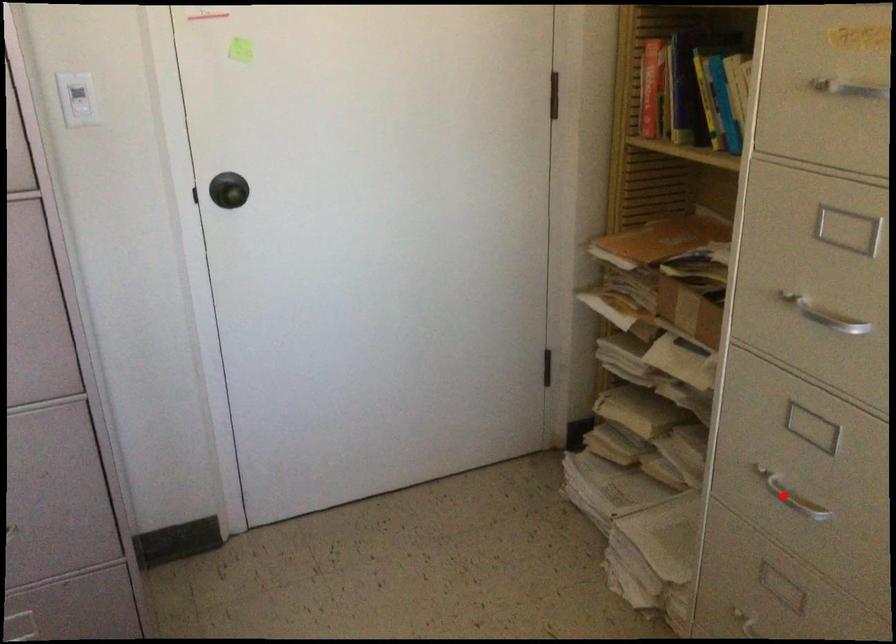
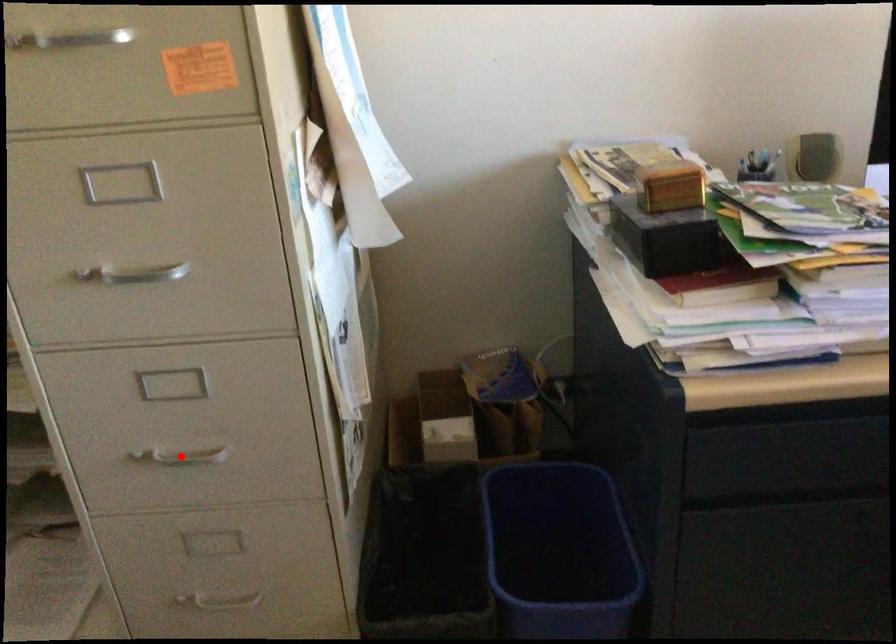
I am providing you with two images of the same scene from different viewpoints. A red point is marked on the first image and another point is marked on the second image. Do the highlighted points in image1 and image2 indicate the same real-world spot?

Yes